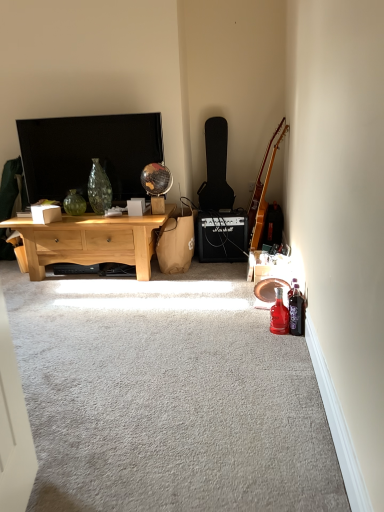
The width and height of the screenshot is (384, 512). What are the coordinates of `free space to the left of translucent purple bottle at lower right, the 2th bottle when ordered from left to right` in the screenshot? It's located at (262, 331).